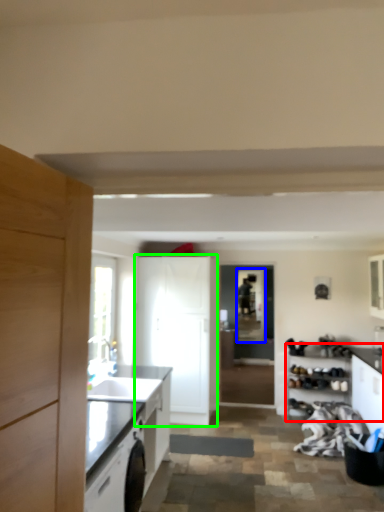
Question: Which is farther away from cabinetry (highlighted by a red box)? window screen (highlighted by a blue box) or cabinetry (highlighted by a green box)?

Choices:
 (A) window screen
 (B) cabinetry

Answer: (B)